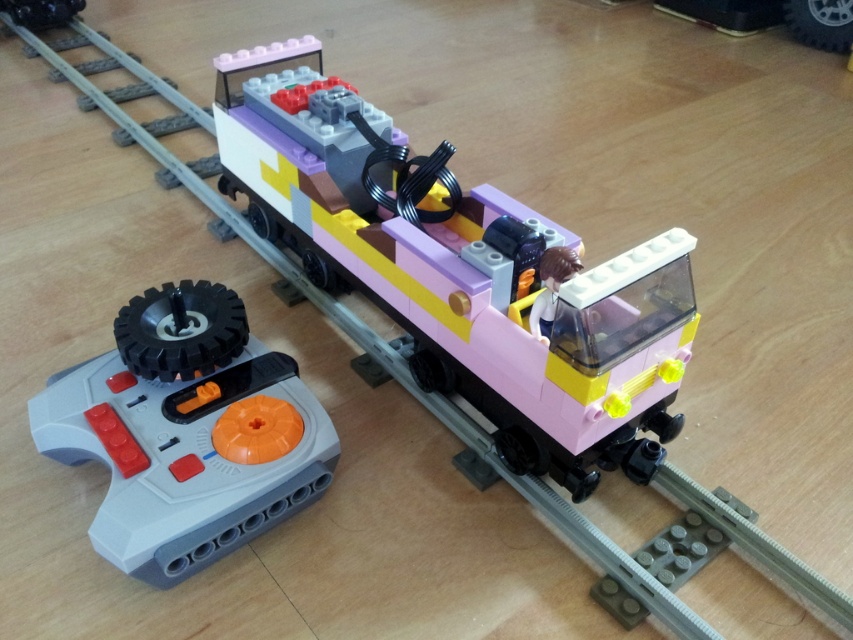
You are a child who wants to play with the pastel pink plastic train car at center and the metallic black remote control at upper left. Which object is closer to the right edge of the wooden surface?

The pastel pink plastic train car at center is positioned on the right side of the metallic black remote control at upper left, so it is closer to the right edge of the wooden surface.

You are a child who wants to play with the gray plastic remote control at lower left. You are currently standing next to the pastel pink plastic train car at center. Can you easily reach the remote control without moving the train?

The pastel pink plastic train car at center is in front of the gray plastic remote control at lower left, so it might block your access to the remote control. Move the train aside to reach it.

You are trying to locate the pastel pink plastic train car at center in the LEGO train set. According to the coordinates provided, where exactly is it positioned?

The pastel pink plastic train car at center is located at point coordinates of 0.422 on the x axis and 0.542 on the y axis.